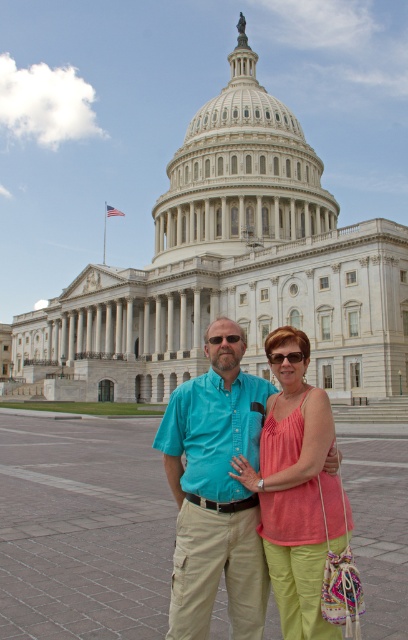
Who is positioned more to the left, matte pink tank top at center or matte black sunglasses at center?

From the viewer's perspective, matte black sunglasses at center appears more on the left side.

Who is shorter, matte pink tank top at center or matte black sunglasses at center?

Standing shorter between the two is matte black sunglasses at center.

Is point (286, 408) positioned before point (281, 355)?

Yes.

The image size is (408, 640). What are the coordinates of `matte pink tank top at center` in the screenshot? It's located at (297, 492).